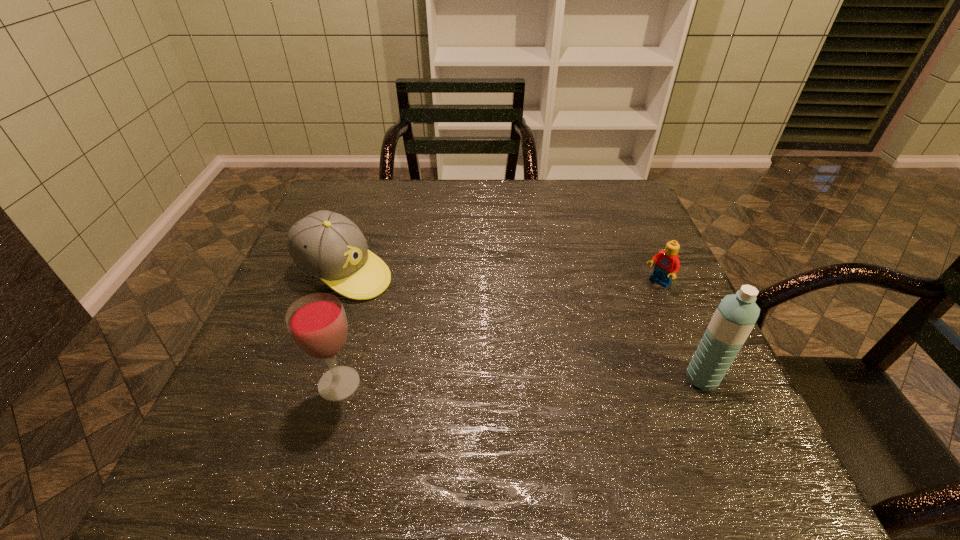
This screenshot has width=960, height=540. Find the location of `blank space at the far edge`. blank space at the far edge is located at coordinates (486, 180).

Locate an element on the screen. Image resolution: width=960 pixels, height=540 pixels. free space at the near edge of the desktop is located at coordinates 412,426.

Where is `vacant space at the right edge of the desktop`? This screenshot has height=540, width=960. vacant space at the right edge of the desktop is located at coordinates (631, 335).

In the image, there is a desktop. Where is `vacant space at the far right corner`? vacant space at the far right corner is located at coordinates (631, 187).

At what (x,y) coordinates should I click in order to perform the action: click on free area in between the third tallest object and the water bottle. Please return your answer as a coordinate pair (x, y). This screenshot has height=540, width=960. Looking at the image, I should click on (523, 325).

The width and height of the screenshot is (960, 540). What are the coordinates of `free area in between the Lego and the water bottle` in the screenshot? It's located at click(680, 330).

Where is `free space between the Lego and the water bottle`? free space between the Lego and the water bottle is located at coordinates tap(680, 330).

Locate an element on the screen. vacant area between the water bottle and the baseball cap is located at coordinates tap(523, 325).

Locate an element on the screen. vacant point located between the second shortest object and the Lego is located at coordinates pos(501,278).

At what (x,y) coordinates should I click in order to perform the action: click on free space between the wineglass and the shortest object. Please return your answer as a coordinate pair (x, y). The width and height of the screenshot is (960, 540). Looking at the image, I should click on (498, 334).